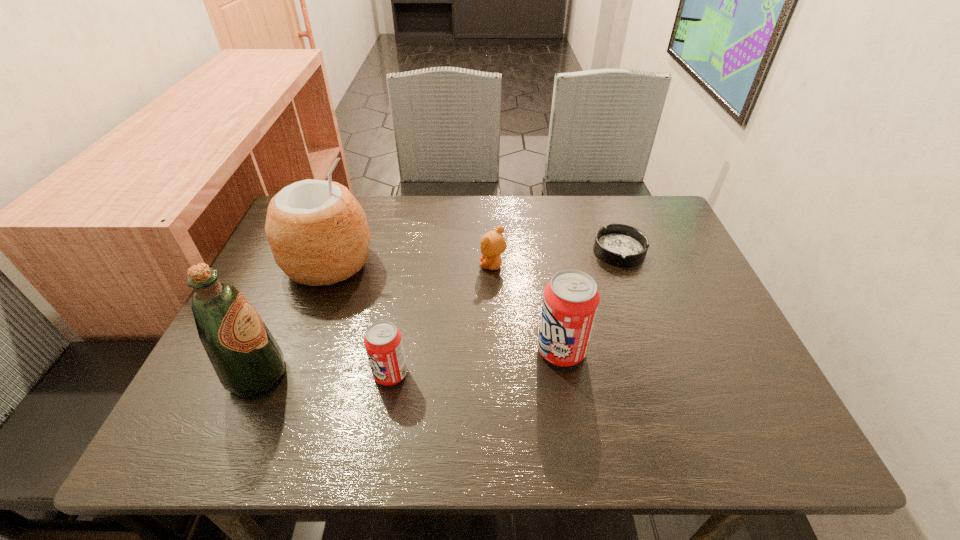
Where is `free space between the left soda can and the olive oil`? Image resolution: width=960 pixels, height=540 pixels. free space between the left soda can and the olive oil is located at coordinates (324, 374).

The width and height of the screenshot is (960, 540). Find the location of `unoccupied area between the shortest object and the teddy bear`. unoccupied area between the shortest object and the teddy bear is located at coordinates (556, 258).

At what (x,y) coordinates should I click in order to perform the action: click on free area in between the olive oil and the teddy bear. Please return your answer as a coordinate pair (x, y). This screenshot has height=540, width=960. Looking at the image, I should click on (375, 320).

Select which object is the closest to the left soda can. Please provide its 2D coordinates. Your answer should be formatted as a tuple, i.e. [(x, y)], where the tuple contains the x and y coordinates of a point satisfying the conditions above.

[(247, 359)]

Point out which object is positioned as the fourth nearest to the fourth object from right to left. Please provide its 2D coordinates. Your answer should be formatted as a tuple, i.e. [(x, y)], where the tuple contains the x and y coordinates of a point satisfying the conditions above.

[(492, 244)]